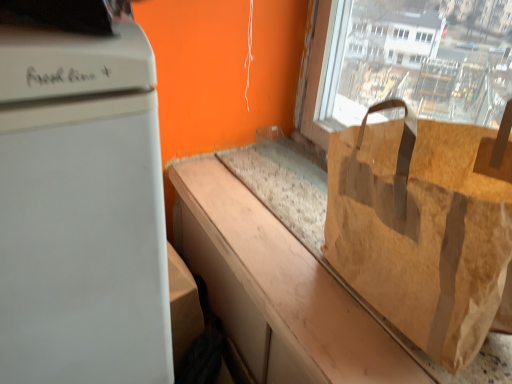
Question: Is white matte refrigerator at left next to brown paper bag at right?

Choices:
 (A) no
 (B) yes

Answer: (A)

Question: Does white matte refrigerator at left have a greater width compared to brown paper bag at right?

Choices:
 (A) yes
 (B) no

Answer: (A)

Question: Can you confirm if white matte refrigerator at left is positioned to the right of brown paper bag at right?

Choices:
 (A) no
 (B) yes

Answer: (A)

Question: Is white matte refrigerator at left at the left side of brown paper bag at right?

Choices:
 (A) yes
 (B) no

Answer: (A)

Question: Is white matte refrigerator at left oriented towards brown paper bag at right?

Choices:
 (A) no
 (B) yes

Answer: (A)

Question: Would you say brown paper bag at right is to the left or to the right of white matte refrigerator at left in the picture?

Choices:
 (A) right
 (B) left

Answer: (A)

Question: Would you say brown paper bag at right is inside or outside white matte refrigerator at left?

Choices:
 (A) inside
 (B) outside

Answer: (B)

Question: From a real-world perspective, is brown paper bag at right above or below white matte refrigerator at left?

Choices:
 (A) below
 (B) above

Answer: (B)

Question: Relative to white matte refrigerator at left, is brown paper bag at right in front or behind?

Choices:
 (A) front
 (B) behind

Answer: (B)

Question: Considering the positions of brown paper bag at center and white matte refrigerator at left in the image, is brown paper bag at center taller or shorter than white matte refrigerator at left?

Choices:
 (A) tall
 (B) short

Answer: (B)

Question: In terms of size, does brown paper bag at center appear bigger or smaller than white matte refrigerator at left?

Choices:
 (A) big
 (B) small

Answer: (B)

Question: From a real-world perspective, is brown paper bag at center physically located above or below white matte refrigerator at left?

Choices:
 (A) above
 (B) below

Answer: (A)

Question: Based on their positions, is brown paper bag at center located to the left or right of white matte refrigerator at left?

Choices:
 (A) left
 (B) right

Answer: (B)

Question: Based on their positions, is brown paper bag at center located to the left or right of brown paper bag at right?

Choices:
 (A) left
 (B) right

Answer: (A)

Question: Looking at their shapes, would you say brown paper bag at center is wider or thinner than brown paper bag at right?

Choices:
 (A) thin
 (B) wide

Answer: (B)